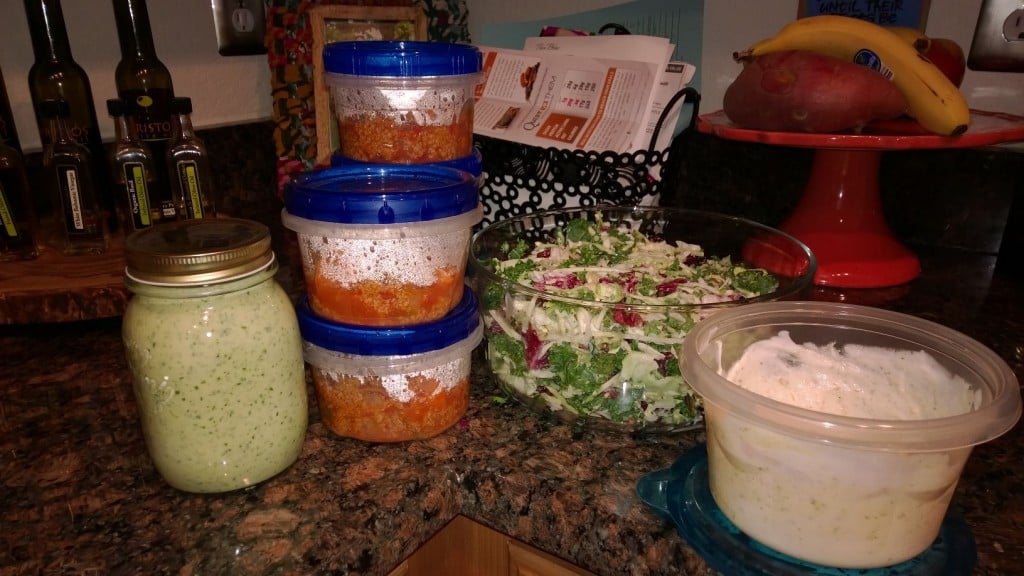
Locate an element on the screen. This screenshot has width=1024, height=576. counter is located at coordinates (426, 454), (80, 397).